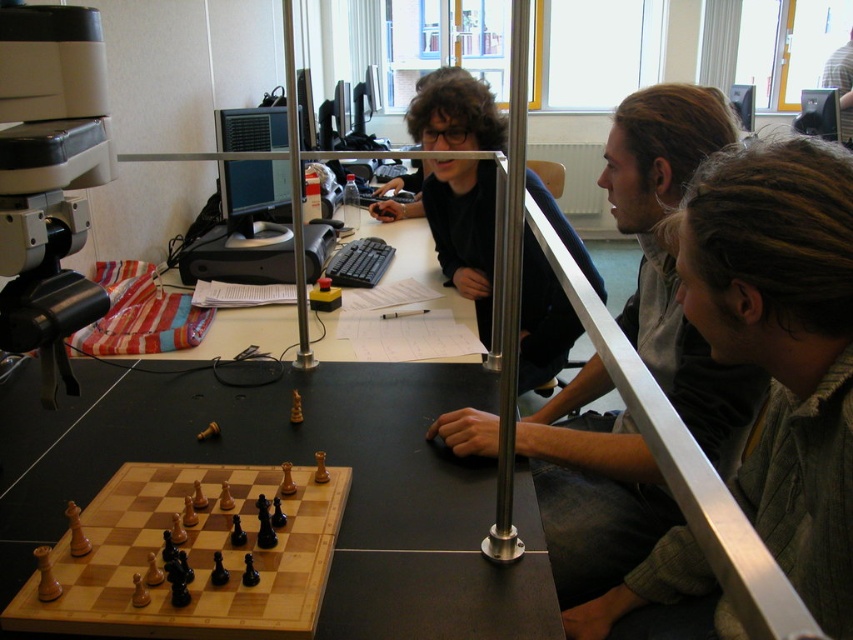
Question: Among these points, which one is nearest to the camera?

Choices:
 (A) (846, 360)
 (B) (253, 429)
 (C) (544, 333)

Answer: (A)

Question: Can you confirm if brown hair at center is bigger than dark brown hair at center?

Choices:
 (A) yes
 (B) no

Answer: (B)

Question: Which of the following is the closest to the observer?

Choices:
 (A) [767, 189]
 (B) [438, 593]
 (C) [132, 467]

Answer: (A)

Question: Which of these objects is positioned closest to the matte black shirt at upper center?

Choices:
 (A) dark brown hair at center
 (B) wooden chessboard at center
 (C) light brown wood chessboard at lower left

Answer: (A)

Question: Does brown hair at center appear under matte black shirt at upper center?

Choices:
 (A) no
 (B) yes

Answer: (B)

Question: In this image, where is wooden chessboard at center located relative to dark brown hair at center?

Choices:
 (A) left
 (B) right

Answer: (A)